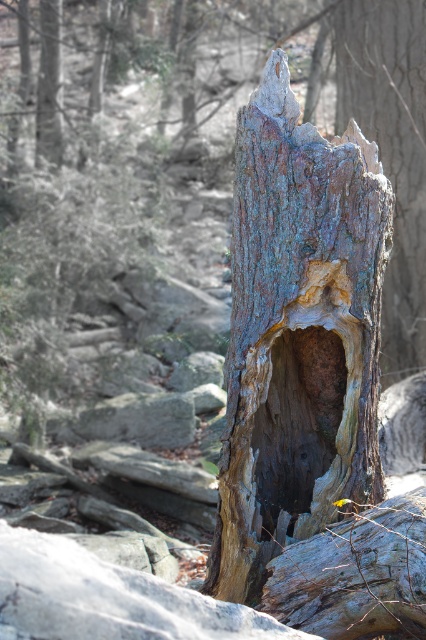
Is rusty wood tree trunk at center to the right of dark wood hole at center from the viewer's perspective?

Indeed, rusty wood tree trunk at center is positioned on the right side of dark wood hole at center.

Between point (351, 321) and point (268, 413), which one is positioned behind?

Point (268, 413)

Between point (235, 339) and point (282, 468), which one is positioned in front?

Positioned in front is point (235, 339).

Image resolution: width=426 pixels, height=640 pixels. Identify the location of rusty wood tree trunk at center. (298, 333).